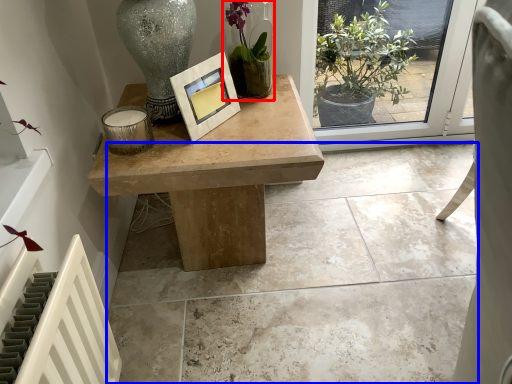
Question: Which object is closer to the camera taking this photo, houseplant (highlighted by a red box) or concrete (highlighted by a blue box)?

Choices:
 (A) houseplant
 (B) concrete

Answer: (B)